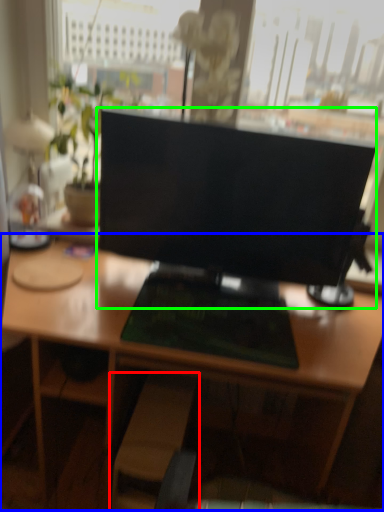
Question: Considering the real-world distances, which object is farthest from swivel chair (highlighted by a red box)? desk (highlighted by a blue box) or computer monitor (highlighted by a green box)?

Choices:
 (A) desk
 (B) computer monitor

Answer: (B)